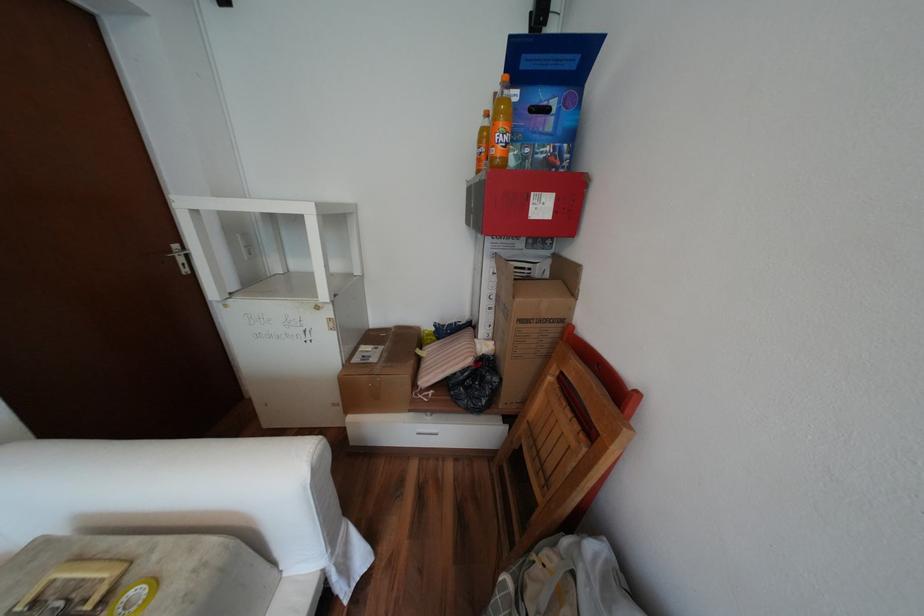
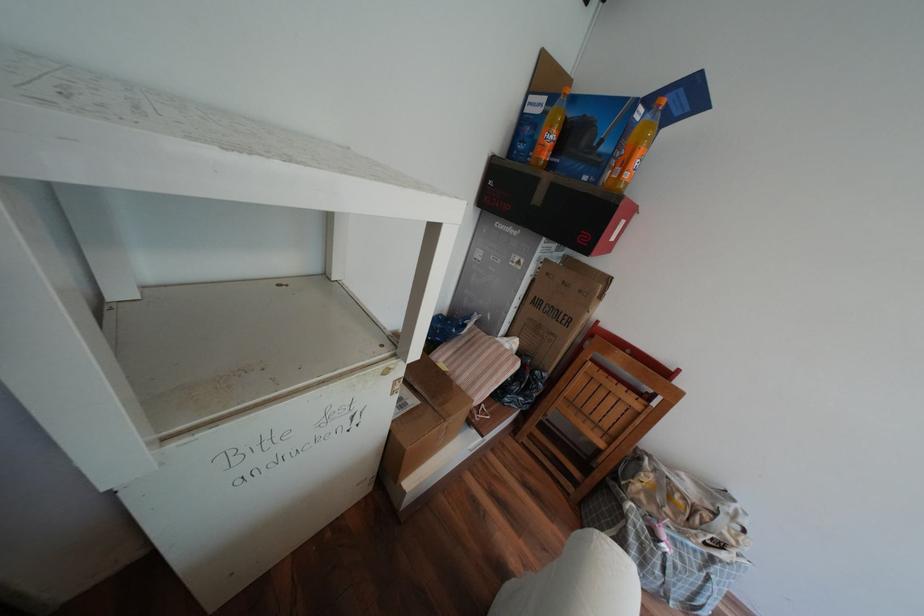
In the second image, find the point that corresponds to (x=472, y=354) in the first image.

(517, 360)